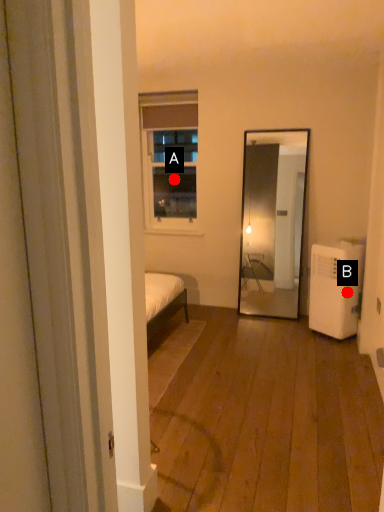
Question: Two points are circled on the image, labeled by A and B beside each circle. Which of the following is the farthest from the observer?

Choices:
 (A) A is further
 (B) B is further

Answer: (A)